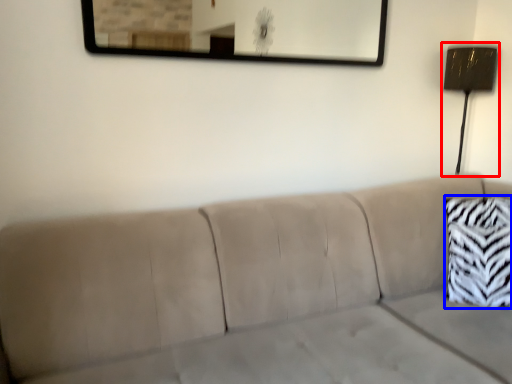
Question: Which point is further to the camera, lamp (highlighted by a red box) or throw pillow (highlighted by a blue box)?

Choices:
 (A) lamp
 (B) throw pillow

Answer: (A)